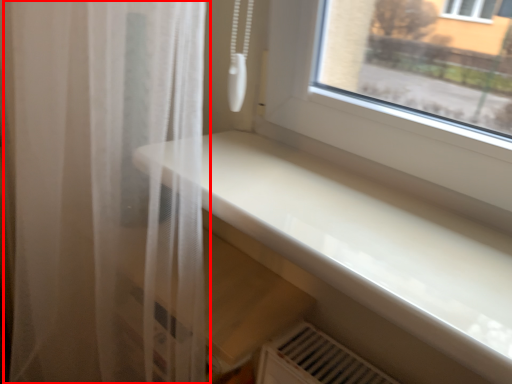
Question: From the image's perspective, considering the relative positions of curtain (annotated by the red box) and counter top in the image provided, where is curtain (annotated by the red box) located with respect to the staircase?

Choices:
 (A) below
 (B) above

Answer: (A)